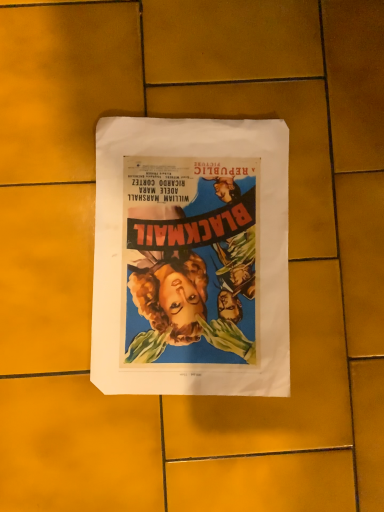
The height and width of the screenshot is (512, 384). Describe the element at coordinates (191, 257) in the screenshot. I see `matte paper poster at center` at that location.

Measure the distance between matte paper poster at center and camera.

The distance of matte paper poster at center from camera is 17.33 inches.

Identify the location of matte paper poster at center. Image resolution: width=384 pixels, height=512 pixels. (191, 257).

At what (x,y) coordinates should I click in order to perform the action: click on matte paper poster at center. Please return your answer as a coordinate pair (x, y). The image size is (384, 512). Looking at the image, I should click on (191, 257).